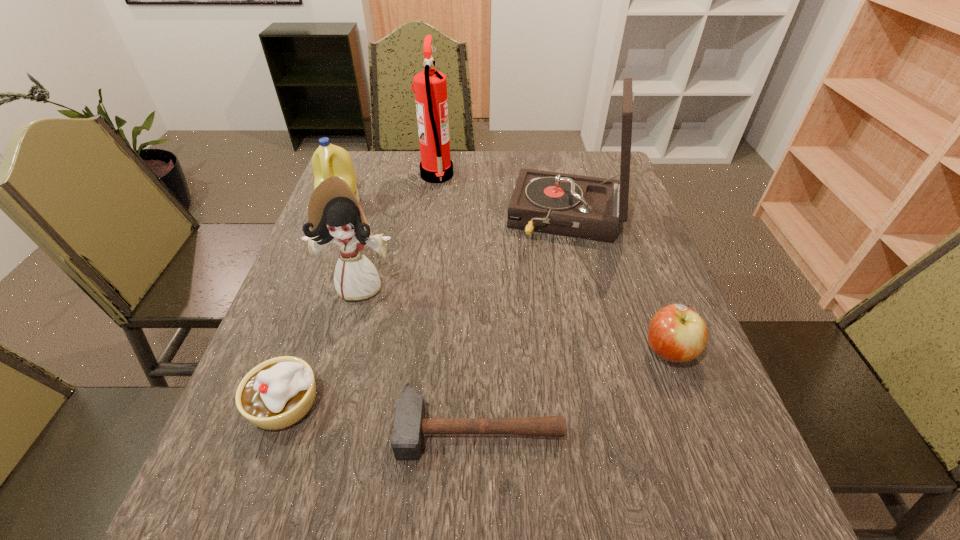
The width and height of the screenshot is (960, 540). In order to click on free space located 0.200m at the front face of the fourth nearest object in this screenshot , I will do click(334, 380).

Locate an element on the screen. vacant area located on the label of the fourth shortest object is located at coordinates (328, 240).

The height and width of the screenshot is (540, 960). Find the location of `vacant area situated 0.160m on the front of the apple`. vacant area situated 0.160m on the front of the apple is located at coordinates (708, 455).

Locate an element on the screen. The image size is (960, 540). vacant space located 0.120m on the front of the whipped cream is located at coordinates (246, 510).

Locate an element on the screen. The image size is (960, 540). fire extinguisher located in the far edge section of the desktop is located at coordinates (430, 86).

The height and width of the screenshot is (540, 960). I want to click on phonograph record that is positioned at the far edge, so click(585, 207).

Where is `doll that is at the left edge`? The width and height of the screenshot is (960, 540). doll that is at the left edge is located at coordinates (334, 214).

At what (x,y) coordinates should I click in order to perform the action: click on detergent located in the left edge section of the desktop. Please return your answer as a coordinate pair (x, y). Looking at the image, I should click on 328,160.

The image size is (960, 540). What are the coordinates of `whipped cream located at the left edge` in the screenshot? It's located at (277, 393).

Identify the location of phonograph record that is at the right edge. (585, 207).